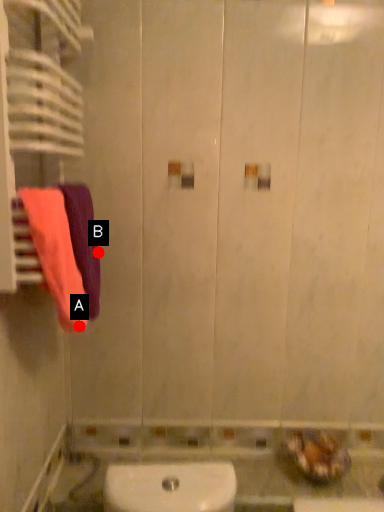
Question: Two points are circled on the image, labeled by A and B beside each circle. Which point is further to the camera?

Choices:
 (A) A is further
 (B) B is further

Answer: (B)